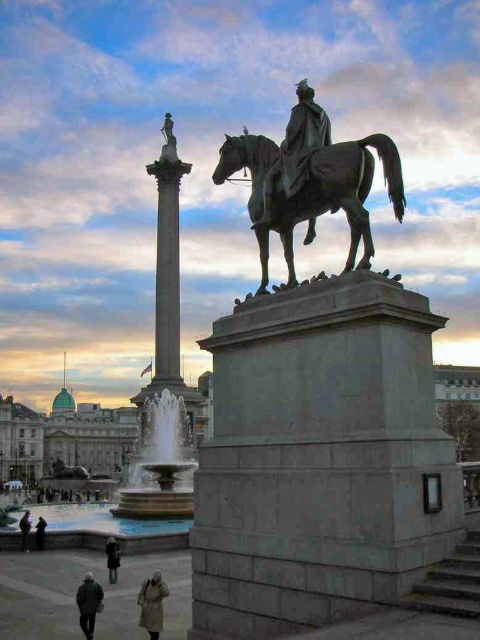
Which is above, bronze statue at center or khaki wool coat at lower center?

bronze statue at center is above.

Does point (248, 208) lie in front of point (151, 614)?

That is False.

I want to click on bronze statue at center, so click(x=313, y=189).

Does dark gray coat at lower center appear over dark gray coat at lower left?

Yes, dark gray coat at lower center is above dark gray coat at lower left.

Which is more to the left, dark gray coat at lower center or dark gray coat at lower left?

From the viewer's perspective, dark gray coat at lower left appears more on the left side.

Which is in front, point (106, 547) or point (22, 528)?

Positioned in front is point (106, 547).

Identify the location of dark gray coat at lower center. (112, 557).

Looking at this image, is dark gray jacket at lower left bigger than dark brown leather coat at lower left?

No, dark gray jacket at lower left is not bigger than dark brown leather coat at lower left.

Is point (83, 627) positioned behind point (37, 516)?

That is False.

Does point (96, 598) lie in front of point (44, 524)?

Yes, point (96, 598) is in front of point (44, 524).

Identify the location of dark gray jacket at lower left. The image size is (480, 640). (88, 604).